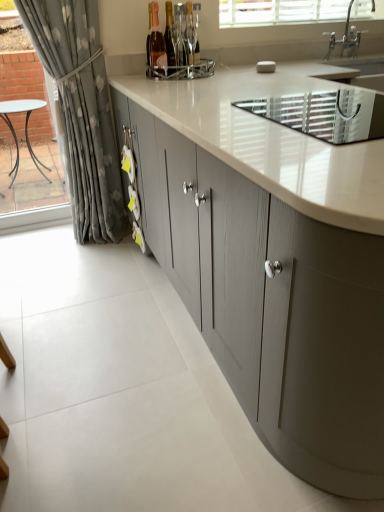
Find the location of a particular element. The height and width of the screenshot is (512, 384). vacant space underneath gray floral fabric curtain at left (from a real-world perspective) is located at coordinates (69, 247).